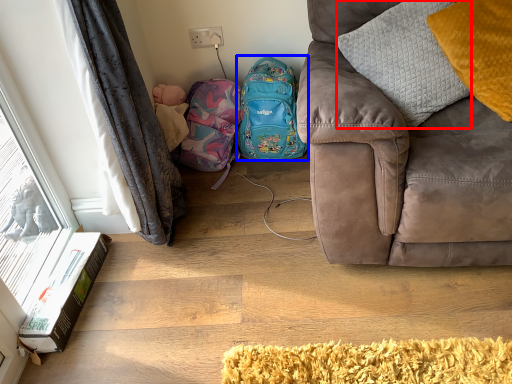
Question: Which point is further to the camera, pillow (highlighted by a red box) or backpack (highlighted by a blue box)?

Choices:
 (A) pillow
 (B) backpack

Answer: (B)